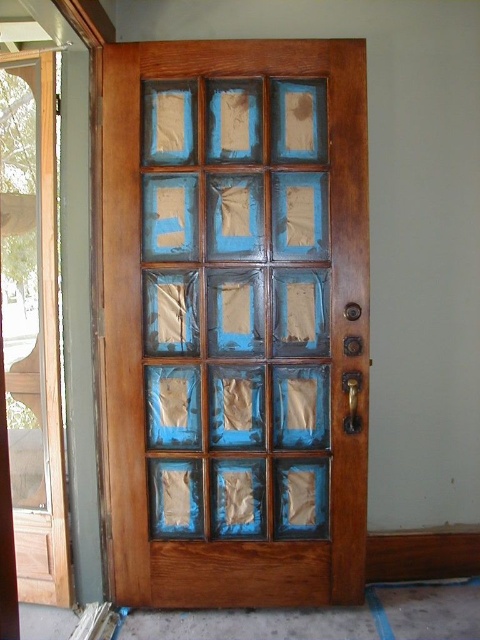
You are trying to decide which door to use to enter the house. The wooden door at center and the clear glass screen door at left are both options. Which door has a larger size?

The wooden door at center is bigger than the clear glass screen door at left, so the wooden door at center has a larger size.